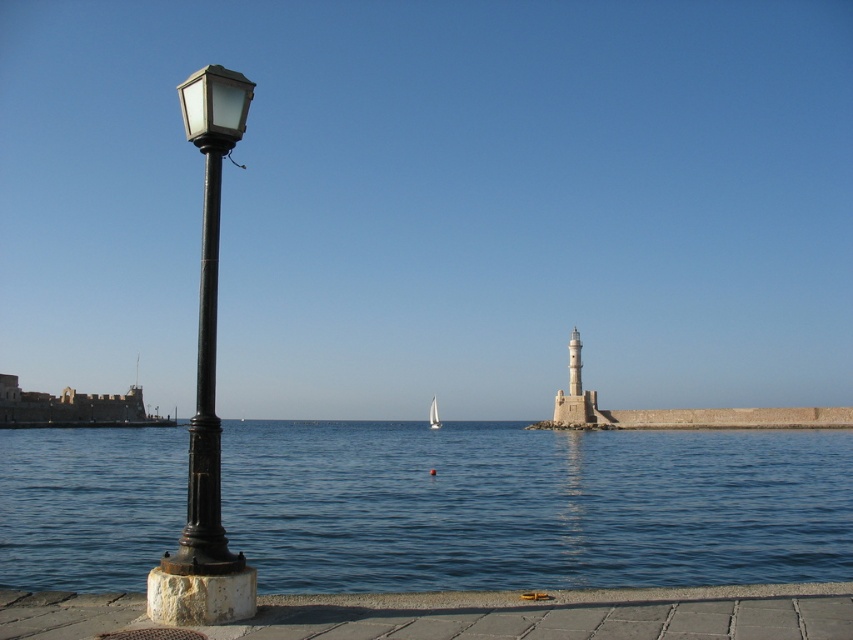
Question: Observing the image, what is the correct spatial positioning of blue water at lower left in reference to matte black street light at left?

Choices:
 (A) right
 (B) left

Answer: (A)

Question: Based on their relative distances, which object is nearer to the white sailboat at center?

Choices:
 (A) matte black street light at left
 (B) matte glass streetlamp at left
 (C) smooth concrete sidewalk at lower center
 (D) blue water at lower left

Answer: (D)

Question: Can you confirm if blue water at lower left is positioned above smooth concrete sidewalk at lower center?

Choices:
 (A) yes
 (B) no

Answer: (B)

Question: Observing the image, what is the correct spatial positioning of blue water at lower left in reference to smooth concrete sidewalk at lower center?

Choices:
 (A) below
 (B) above

Answer: (A)

Question: Among these points, which one is farthest from the camera?

Choices:
 (A) (837, 429)
 (B) (428, 419)

Answer: (B)

Question: Among these objects, which one is nearest to the camera?

Choices:
 (A) white sailboat at center
 (B) matte black street light at left
 (C) matte glass streetlamp at left
 (D) smooth concrete sidewalk at lower center

Answer: (D)